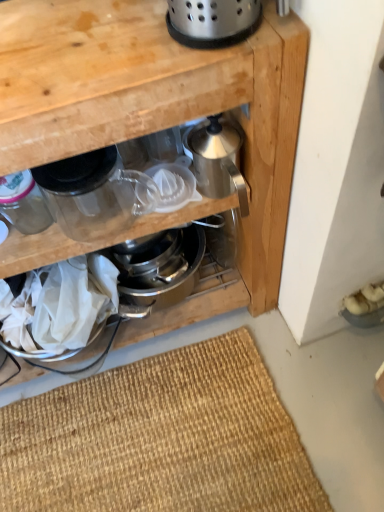
Question: From a real-world perspective, is transparent plastic juicer at center, marked as the 2th appliance in a left-to-right arrangement, located beneath polished stainless steel colander at upper center, marked as the second appliance in a right-to-left arrangement?

Choices:
 (A) no
 (B) yes

Answer: (B)

Question: Can you confirm if transparent plastic juicer at center, which is counted as the 3th appliance, starting from the right, is taller than polished stainless steel colander at upper center, marked as the second appliance in a right-to-left arrangement?

Choices:
 (A) yes
 (B) no

Answer: (B)

Question: Can we say transparent plastic juicer at center, marked as the 2th appliance in a left-to-right arrangement, lies outside polished stainless steel colander at upper center, marked as the second appliance in a right-to-left arrangement?

Choices:
 (A) yes
 (B) no

Answer: (A)

Question: Can you see transparent plastic juicer at center, which is counted as the 3th appliance, starting from the right, touching polished stainless steel colander at upper center, marked as the second appliance in a right-to-left arrangement?

Choices:
 (A) yes
 (B) no

Answer: (B)

Question: Does transparent plastic juicer at center, which is counted as the 3th appliance, starting from the right, appear on the right side of polished stainless steel colander at upper center, marked as the second appliance in a right-to-left arrangement?

Choices:
 (A) yes
 (B) no

Answer: (B)

Question: From a real-world perspective, is transparent glass jar at left, the fourth appliance positioned from the right, above or below satin silver juicer at center?

Choices:
 (A) below
 (B) above

Answer: (B)

Question: Is transparent glass jar at left, the first appliance viewed from the left, bigger or smaller than satin silver juicer at center?

Choices:
 (A) small
 (B) big

Answer: (A)

Question: Based on their positions, is transparent glass jar at left, the first appliance viewed from the left, located to the left or right of satin silver juicer at center?

Choices:
 (A) right
 (B) left

Answer: (B)

Question: Would you say transparent glass jar at left, the first appliance viewed from the left, is inside or outside satin silver juicer at center?

Choices:
 (A) outside
 (B) inside

Answer: (B)

Question: From a real-world perspective, is satin silver juicer at center above or below polished stainless steel colander at upper center, which ranks as the third appliance in left-to-right order?

Choices:
 (A) above
 (B) below

Answer: (B)

Question: From the image's perspective, is satin silver juicer at center above or below polished stainless steel colander at upper center, which ranks as the third appliance in left-to-right order?

Choices:
 (A) below
 (B) above

Answer: (A)

Question: Considering the relative positions of satin silver juicer at center and polished stainless steel colander at upper center, which ranks as the third appliance in left-to-right order, in the image provided, is satin silver juicer at center to the left or to the right of polished stainless steel colander at upper center, which ranks as the third appliance in left-to-right order,?

Choices:
 (A) left
 (B) right

Answer: (A)

Question: Relative to polished stainless steel colander at upper center, which ranks as the third appliance in left-to-right order, is satin silver juicer at center in front or behind?

Choices:
 (A) behind
 (B) front

Answer: (A)

Question: Is stainless steel kettle at center, which ranks as the 4th appliance in left-to-right order, spatially inside polished stainless steel colander at upper center, which ranks as the third appliance in left-to-right order, or outside of it?

Choices:
 (A) outside
 (B) inside

Answer: (A)

Question: Looking at the image, does stainless steel kettle at center, the 1th appliance viewed from the right, seem bigger or smaller compared to polished stainless steel colander at upper center, which ranks as the third appliance in left-to-right order?

Choices:
 (A) small
 (B) big

Answer: (A)